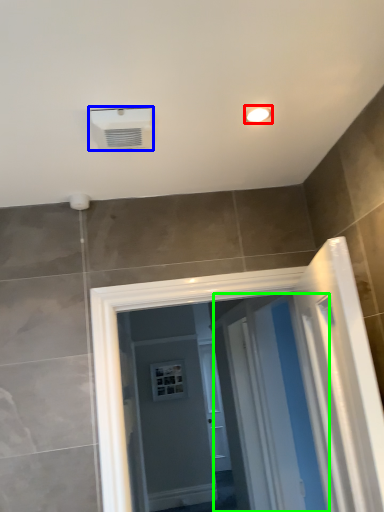
Question: Which is nearer to the light fixture (highlighted by a red box)? air conditioning (highlighted by a blue box) or screen door (highlighted by a green box).

Choices:
 (A) air conditioning
 (B) screen door

Answer: (A)